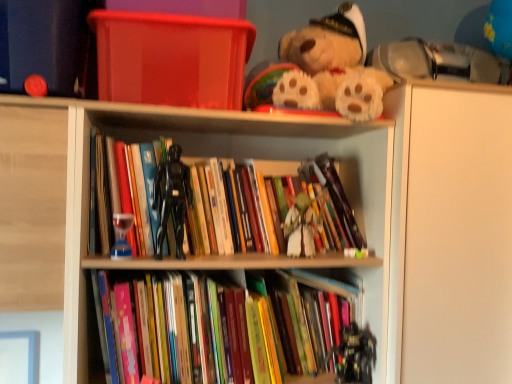
Question: Is fluffy beige teddy bear at upper center oriented away from wooden books at center?

Choices:
 (A) yes
 (B) no

Answer: (B)

Question: From a real-world perspective, is fluffy beige teddy bear at upper center positioned over wooden books at center based on gravity?

Choices:
 (A) no
 (B) yes

Answer: (B)

Question: Are fluffy beige teddy bear at upper center and wooden books at center far apart?

Choices:
 (A) no
 (B) yes

Answer: (A)

Question: Considering the relative sizes of fluffy beige teddy bear at upper center and wooden books at center in the image provided, is fluffy beige teddy bear at upper center thinner than wooden books at center?

Choices:
 (A) yes
 (B) no

Answer: (A)

Question: Could you tell me if fluffy beige teddy bear at upper center is facing wooden books at center?

Choices:
 (A) yes
 (B) no

Answer: (B)

Question: From their relative heights in the image, would you say white matte cabinet at upper right is taller or shorter than transparent plastic container at upper center?

Choices:
 (A) short
 (B) tall

Answer: (B)

Question: Considering the positions of white matte cabinet at upper right and transparent plastic container at upper center in the image, is white matte cabinet at upper right wider or thinner than transparent plastic container at upper center?

Choices:
 (A) thin
 (B) wide

Answer: (B)

Question: Is white matte cabinet at upper right spatially inside transparent plastic container at upper center, or outside of it?

Choices:
 (A) outside
 (B) inside

Answer: (A)

Question: From a real-world perspective, relative to transparent plastic container at upper center, is white matte cabinet at upper right vertically above or below?

Choices:
 (A) below
 (B) above

Answer: (A)

Question: Looking at their shapes, would you say transparent plastic container at upper center is wider or thinner than white matte cabinet at upper right?

Choices:
 (A) thin
 (B) wide

Answer: (A)

Question: In terms of height, does transparent plastic container at upper center look taller or shorter compared to white matte cabinet at upper right?

Choices:
 (A) tall
 (B) short

Answer: (B)

Question: From the image's perspective, is transparent plastic container at upper center positioned above or below white matte cabinet at upper right?

Choices:
 (A) above
 (B) below

Answer: (A)

Question: Which is correct: transparent plastic container at upper center is inside white matte cabinet at upper right, or outside of it?

Choices:
 (A) inside
 (B) outside

Answer: (B)

Question: Would you say translucent glass hourglass at center, acting as the first toy starting from the left, is to the left or to the right of wooden books at center in the picture?

Choices:
 (A) left
 (B) right

Answer: (A)

Question: Is translucent glass hourglass at center, acting as the first toy starting from the left, in front of or behind wooden books at center in the image?

Choices:
 (A) behind
 (B) front

Answer: (A)